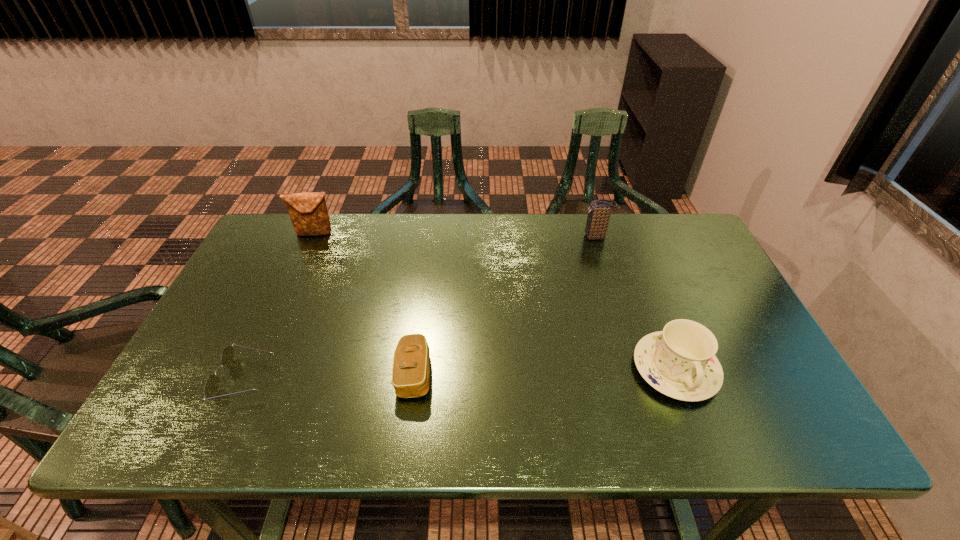
Where is `free space between the spectacles and the leftmost clutch bag`? The width and height of the screenshot is (960, 540). free space between the spectacles and the leftmost clutch bag is located at coordinates (280, 306).

Locate an element on the screen. The height and width of the screenshot is (540, 960). unoccupied position between the chinaware and the leftmost clutch bag is located at coordinates (495, 301).

Identify the location of free spot between the leftmost clutch bag and the third shortest object. The width and height of the screenshot is (960, 540). (495, 301).

Where is `free space between the rightmost clutch bag and the third object from left to right`? free space between the rightmost clutch bag and the third object from left to right is located at coordinates (505, 305).

Find the location of `vacant area that lies between the shortest clutch bag and the rightmost clutch bag`. vacant area that lies between the shortest clutch bag and the rightmost clutch bag is located at coordinates (x=505, y=305).

Find the location of a particular element. vacant region between the rightmost clutch bag and the chinaware is located at coordinates coord(636,303).

What are the coordinates of `unoccupied area between the rightmost clutch bag and the shortest object` in the screenshot? It's located at [x=421, y=308].

Identify the location of free spot between the rightmost clutch bag and the fourth tallest object. (505, 305).

At what (x,y) coordinates should I click in order to perform the action: click on object that is the second closest to the rightmost clutch bag. Please return your answer as a coordinate pair (x, y). Looking at the image, I should click on (411, 362).

Locate which object ranks fourth in proximity to the second clutch bag from left to right. Please provide its 2D coordinates. Your answer should be formatted as a tuple, i.e. [(x, y)], where the tuple contains the x and y coordinates of a point satisfying the conditions above.

[(599, 213)]